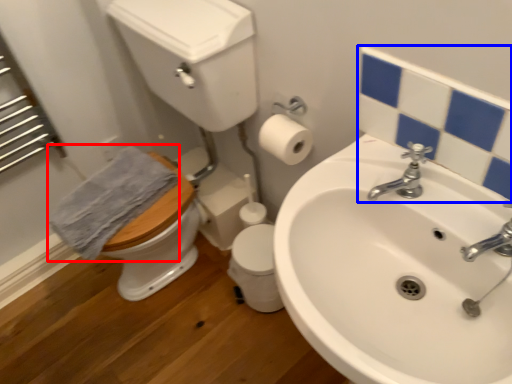
Question: Among these objects, which one is farthest to the camera, bath towel (highlighted by a red box) or mirror (highlighted by a blue box)?

Choices:
 (A) bath towel
 (B) mirror

Answer: (A)